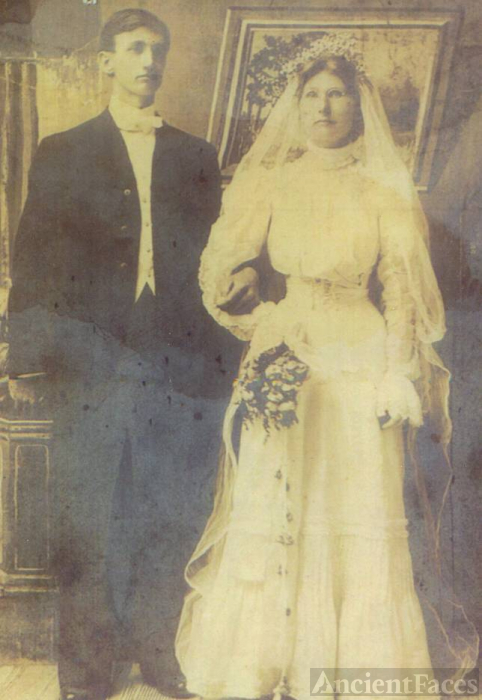
The width and height of the screenshot is (482, 700). Identify the location of bouquet. (261, 374).